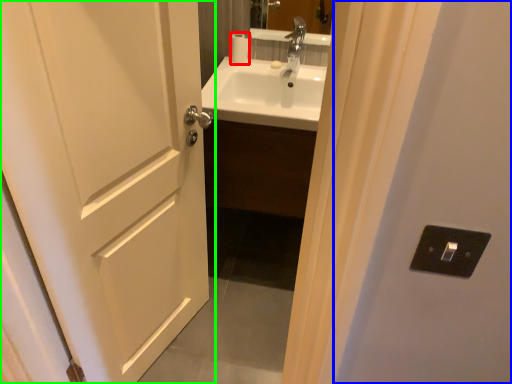
Question: Estimate the real-world distances between objects in this image. Which object is closer to toilet paper (highlighted by a red box), screen door (highlighted by a blue box) or door (highlighted by a green box)?

Choices:
 (A) screen door
 (B) door

Answer: (B)